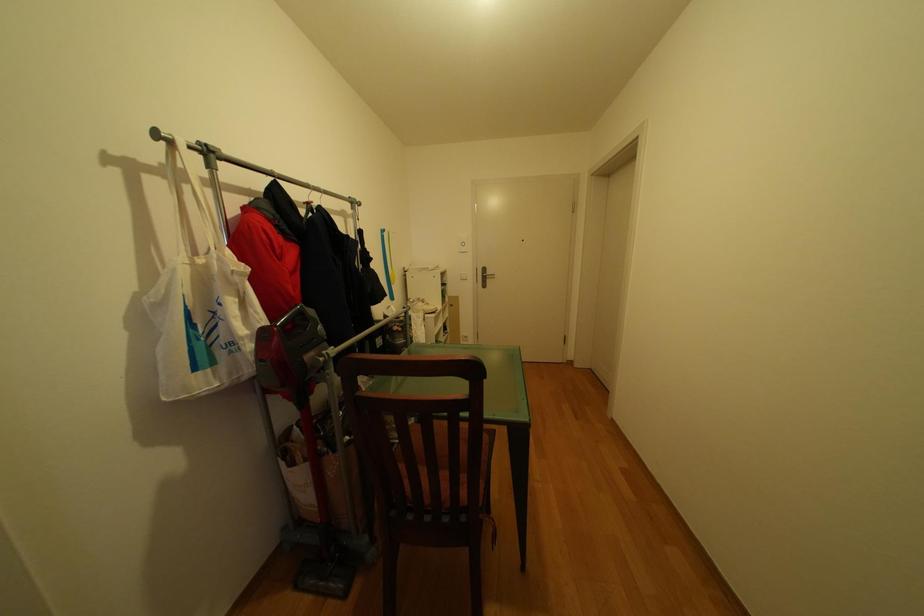
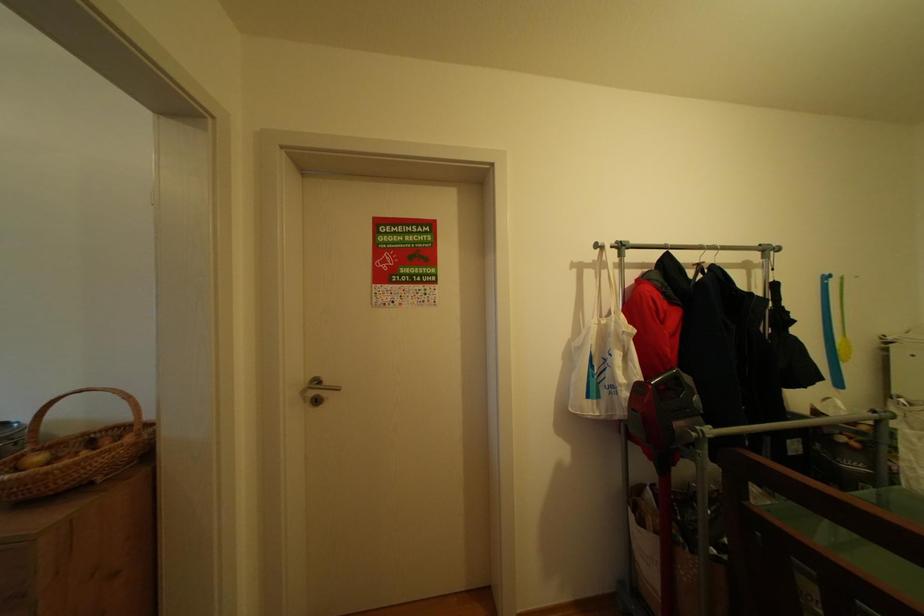
Question: Based on the continuous images, in which direction is the camera rotating? Reply with the corresponding letter.

Choices:
 (A) Left
 (B) Right
 (C) Up
 (D) Down

Answer: (A)